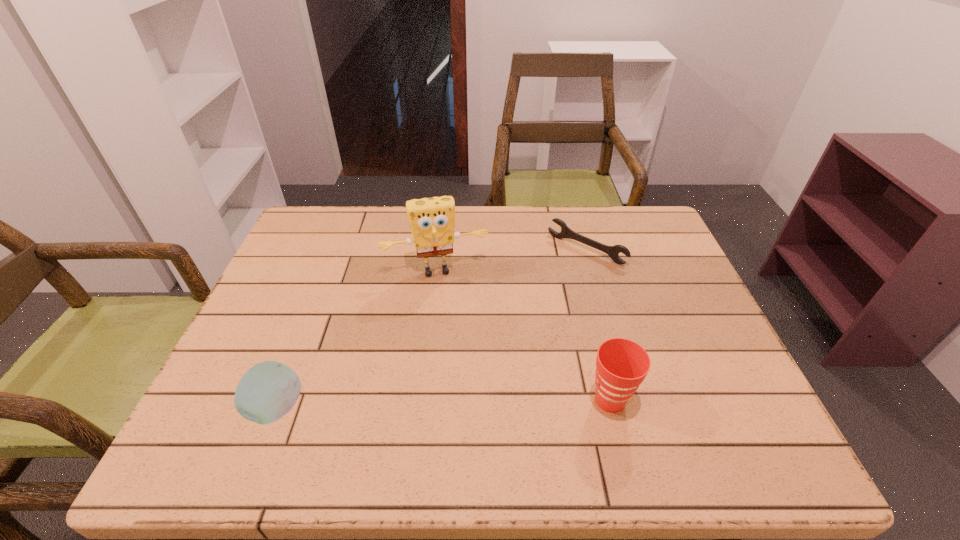
Locate an element on the screen. The height and width of the screenshot is (540, 960). empty space that is in between the second object from left to right and the third shortest object is located at coordinates (523, 336).

At what (x,y) coordinates should I click in order to perform the action: click on free spot between the third object from right to left and the leftmost object. Please return your answer as a coordinate pair (x, y). Looking at the image, I should click on (356, 340).

This screenshot has height=540, width=960. Identify the location of free area in between the leftmost object and the cup. (444, 404).

The width and height of the screenshot is (960, 540). What are the coordinates of `free spot between the wrench and the second object from left to right` in the screenshot? It's located at (511, 260).

Image resolution: width=960 pixels, height=540 pixels. In order to click on vacant area that lies between the wrench and the third shortest object in this screenshot , I will do `click(598, 325)`.

Where is `free space between the tallest object and the cup`? The image size is (960, 540). free space between the tallest object and the cup is located at coordinates (523, 336).

Locate an element on the screen. free space between the third object from right to left and the cup is located at coordinates (x=523, y=336).

You are a GUI agent. You are given a task and a screenshot of the screen. Output one action in this format:
    pyautogui.click(x=<x>, y=<y>)
    Task: Click on the object that is the nearest to the wrench
    This screenshot has height=540, width=960.
    Given the screenshot: What is the action you would take?
    pyautogui.click(x=432, y=220)

This screenshot has height=540, width=960. Identify the location of object that is the nearest to the second tallest object. (432, 220).

Locate an element on the screen. Image resolution: width=960 pixels, height=540 pixels. free space that satisfies the following two spatial constraints: 1. on the back side of the leftmost object; 2. on the left side of the shortest object is located at coordinates (338, 249).